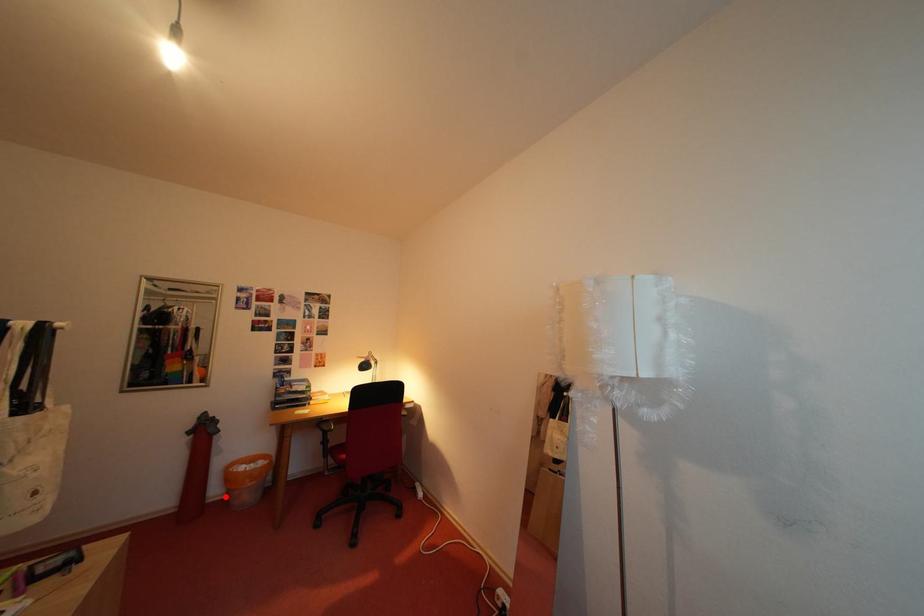
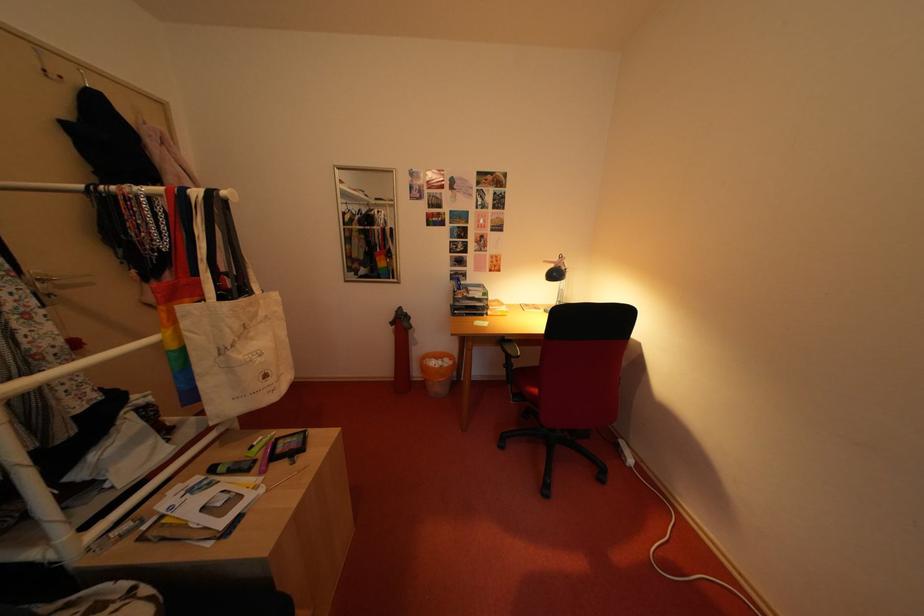
In the second image, find the point that corresponds to the highlighted location in the first image.

(427, 379)